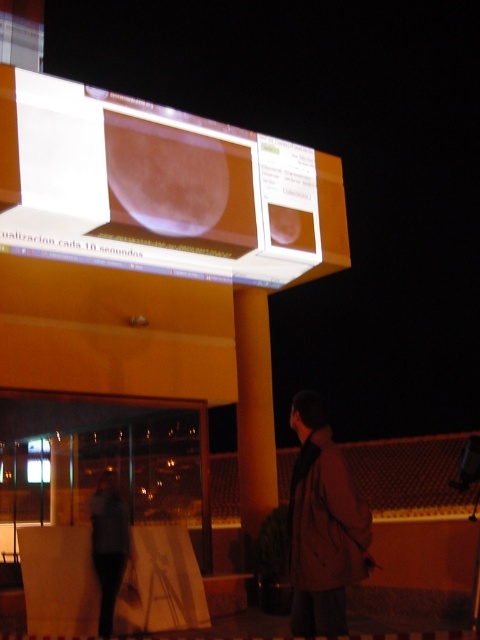
Question: Can you confirm if matte glass screen at upper center is smaller than brown leather jacket at lower right?

Choices:
 (A) no
 (B) yes

Answer: (A)

Question: Which point is closer to the camera?

Choices:
 (A) (218, 177)
 (B) (117, 557)
 (C) (308, 579)

Answer: (C)

Question: Does matte glass screen at upper center have a greater width compared to brown leather jacket at lower right?

Choices:
 (A) yes
 (B) no

Answer: (A)

Question: Among these points, which one is farthest from the camera?

Choices:
 (A) (108, 557)
 (B) (296, 497)

Answer: (A)

Question: Does matte glass screen at upper center have a greater width compared to brown leather jacket at lower right?

Choices:
 (A) no
 (B) yes

Answer: (B)

Question: Which of the following is the closest to the observer?

Choices:
 (A) (311, 413)
 (B) (294, 145)
 (C) (116, 476)

Answer: (A)